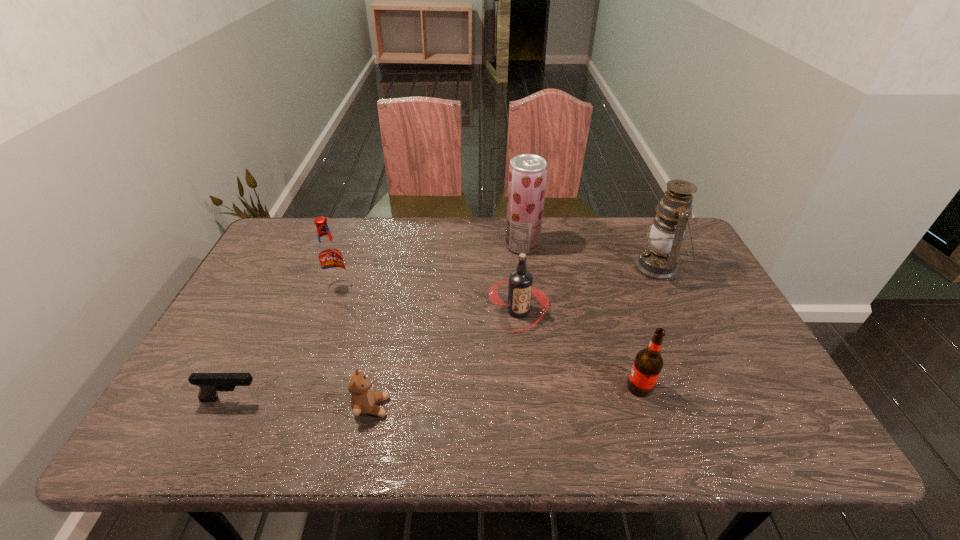
Identify which object is located as the second nearest to the second object from left to right. Please provide its 2D coordinates. Your answer should be formatted as a tuple, i.e. [(x, y)], where the tuple contains the x and y coordinates of a point satisfying the conditions above.

[(209, 383)]

Identify the location of the closest root beer relative to the rightmost object. This screenshot has width=960, height=540. (520, 287).

Point out which root beer is positioned as the third nearest to the rightmost object. Please provide its 2D coordinates. Your answer should be formatted as a tuple, i.e. [(x, y)], where the tuple contains the x and y coordinates of a point satisfying the conditions above.

[(330, 257)]

The image size is (960, 540). In order to click on vacant area that satisfies the following two spatial constraints: 1. on the front side of the oil lamp; 2. on the front-facing side of the pistol in this screenshot , I will do point(720,400).

Where is `free spot that satisfies the following two spatial constraints: 1. on the label of the second root beer from right to left; 2. on the left side of the nearest root beer`? This screenshot has width=960, height=540. free spot that satisfies the following two spatial constraints: 1. on the label of the second root beer from right to left; 2. on the left side of the nearest root beer is located at coordinates (525, 387).

Locate an element on the screen. vacant region that satisfies the following two spatial constraints: 1. on the label of the second root beer from left to right; 2. on the left side of the rightmost root beer is located at coordinates (525, 387).